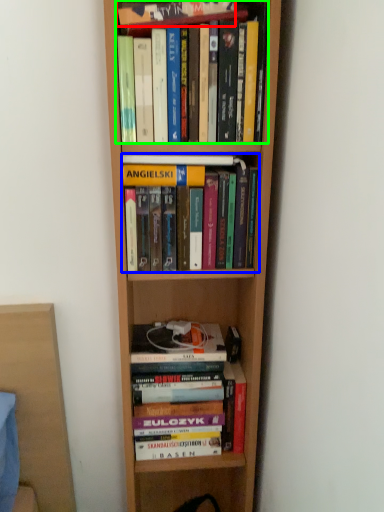
Question: Estimate the real-world distances between objects in this image. Which object is farther from book (highlighted by a red box), book (highlighted by a blue box) or book (highlighted by a green box)?

Choices:
 (A) book
 (B) book

Answer: (A)